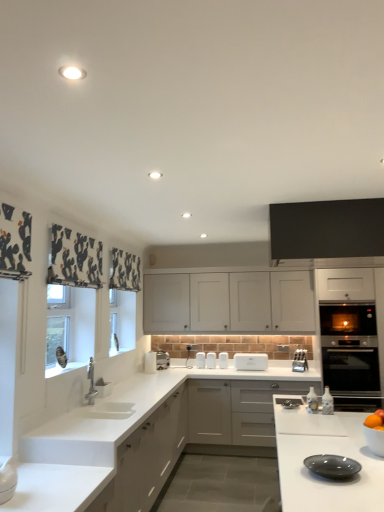
Question: Is white matte cabinet at center, marked as the third cabinetry in a top-to-bottom arrangement, not inside black glass oven at right, acting as the first oven starting from the top?

Choices:
 (A) yes
 (B) no

Answer: (A)

Question: Is white matte cabinet at center, the 2th cabinetry when ordered from front to back, in contact with black glass oven at right, the 2th oven ordered from the bottom?

Choices:
 (A) yes
 (B) no

Answer: (B)

Question: Does white matte cabinet at center, the 1th cabinetry when ordered from bottom to top, turn towards black glass oven at right, acting as the first oven starting from the top?

Choices:
 (A) no
 (B) yes

Answer: (A)

Question: Is the depth of white matte cabinet at center, marked as the third cabinetry in a top-to-bottom arrangement, less than that of black glass oven at right, acting as the first oven starting from the top?

Choices:
 (A) yes
 (B) no

Answer: (B)

Question: Does white matte cabinet at center, marked as the third cabinetry in a top-to-bottom arrangement, have a smaller size compared to black glass oven at right, the 2th oven ordered from the bottom?

Choices:
 (A) yes
 (B) no

Answer: (A)

Question: Would you say metallic silver knife block at lower right, arranged as the first appliance when viewed from the right, is inside or outside black stainless steel oven at right, which is the first oven from bottom to top?

Choices:
 (A) inside
 (B) outside

Answer: (B)

Question: Relative to black stainless steel oven at right, which is counted as the second oven, starting from the top, is metallic silver knife block at lower right, arranged as the first appliance when viewed from the right, in front or behind?

Choices:
 (A) front
 (B) behind

Answer: (B)

Question: In terms of height, does metallic silver knife block at lower right, arranged as the first appliance when viewed from the right, look taller or shorter compared to black stainless steel oven at right, which is the first oven from bottom to top?

Choices:
 (A) short
 (B) tall

Answer: (A)

Question: From a real-world perspective, relative to black stainless steel oven at right, which is the first oven from bottom to top, is metallic silver knife block at lower right, arranged as the first appliance when viewed from the right, vertically above or below?

Choices:
 (A) above
 (B) below

Answer: (A)

Question: Considering the positions of point (365, 282) and point (155, 360), is point (365, 282) closer or farther from the camera than point (155, 360)?

Choices:
 (A) closer
 (B) farther

Answer: (B)

Question: In terms of width, does black glass oven at right, acting as the first oven starting from the top, look wider or thinner when compared to white glossy paper towel dispenser at upper center, the 1th appliance positioned from the left?

Choices:
 (A) wide
 (B) thin

Answer: (A)

Question: From a real-world perspective, is black glass oven at right, acting as the first oven starting from the top, positioned above or below white glossy paper towel dispenser at upper center, the 1th appliance positioned from the left?

Choices:
 (A) below
 (B) above

Answer: (B)

Question: From the image's perspective, is black glass oven at right, acting as the first oven starting from the top, above or below white glossy paper towel dispenser at upper center, the 2th appliance positioned from the right?

Choices:
 (A) above
 (B) below

Answer: (A)

Question: Based on their sizes in the image, would you say matte gray plate at lower right is bigger or smaller than black stainless steel oven at right, which is counted as the second oven, starting from the top?

Choices:
 (A) small
 (B) big

Answer: (A)

Question: From the image's perspective, is matte gray plate at lower right positioned above or below black stainless steel oven at right, which is the first oven from bottom to top?

Choices:
 (A) above
 (B) below

Answer: (A)